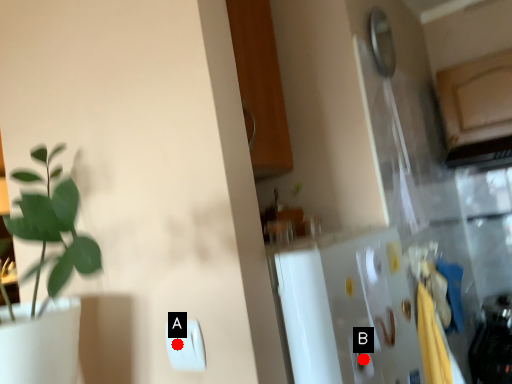
Question: Two points are circled on the image, labeled by A and B beside each circle. Which of the following is the farthest from the observer?

Choices:
 (A) A is further
 (B) B is further

Answer: (B)